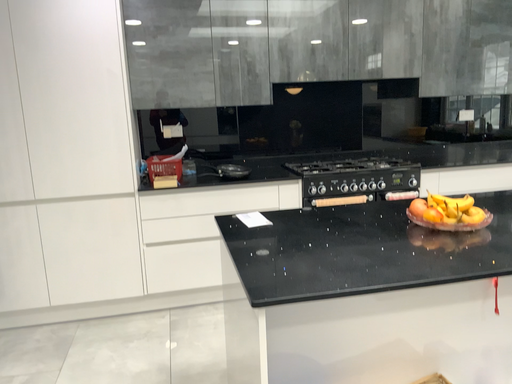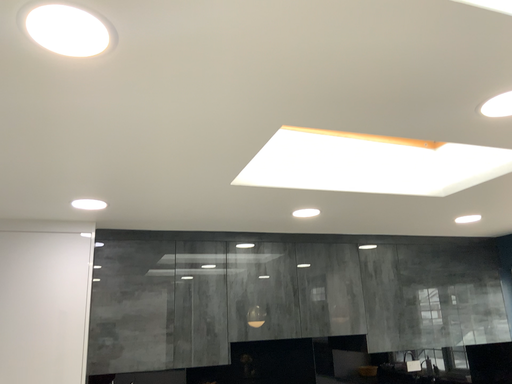
Question: How did the camera likely rotate when shooting the video?

Choices:
 (A) rotated upward
 (B) rotated downward

Answer: (A)